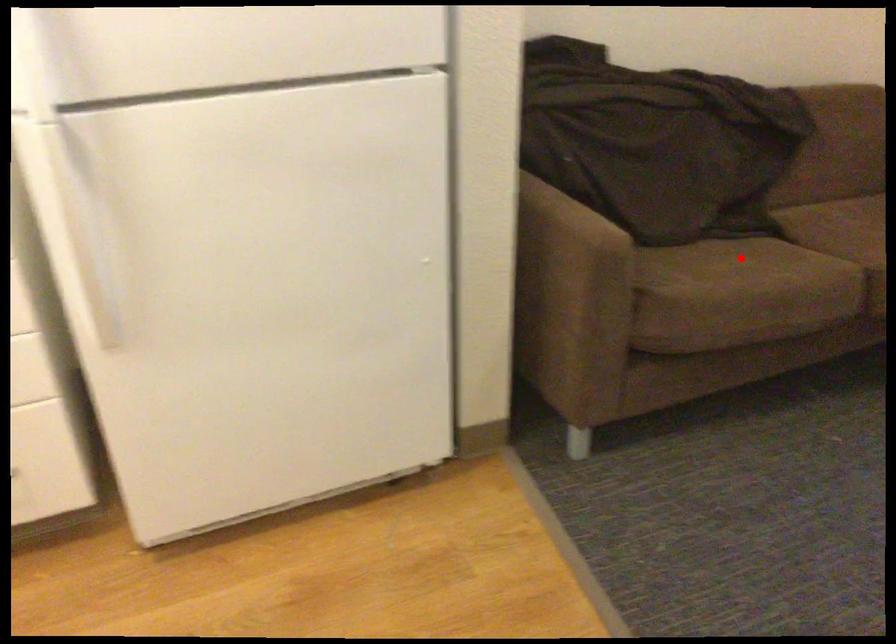
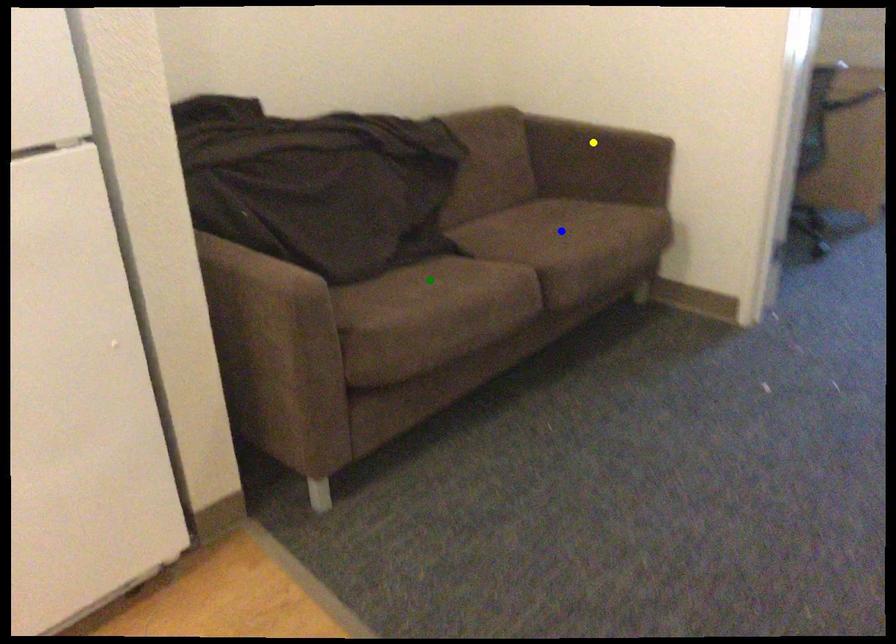
Question: I am providing you with two images of the same scene from different viewpoints. A red point is marked on the first image. You are given multiple points on the second image. Which mark in image 2 goes with the point in image 1?

Choices:
 (A) yellow point
 (B) blue point
 (C) green point

Answer: (C)